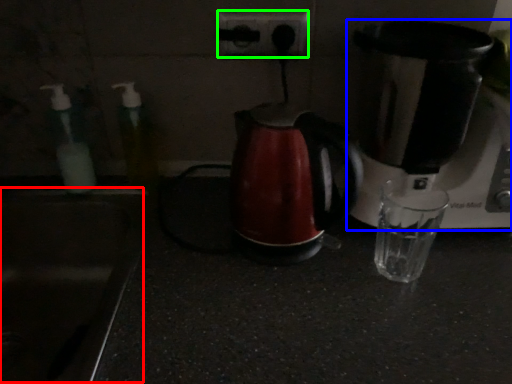
Question: Which is farther away from sink (highlighted by a red box)? coffee maker (highlighted by a blue box) or power plugs and sockets (highlighted by a green box)?

Choices:
 (A) coffee maker
 (B) power plugs and sockets

Answer: (A)